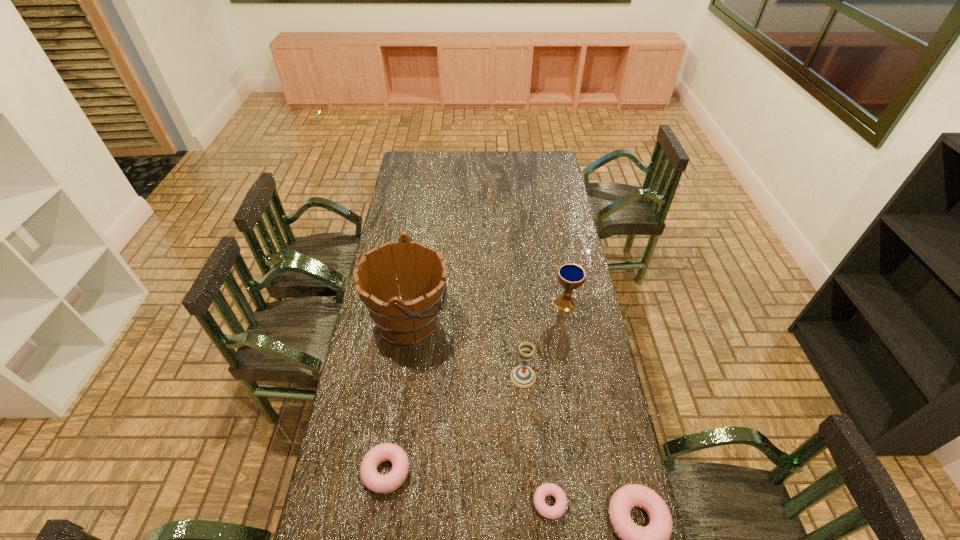
You are a GUI agent. You are given a task and a screenshot of the screen. Output one action in this format:
    pyautogui.click(x=<x>, y=<y>)
    Task: Click on the vacant space at the right edge of the desktop
    This screenshot has height=540, width=960.
    Given the screenshot: What is the action you would take?
    pyautogui.click(x=626, y=481)

Identify the location of free space that is in between the left chalice and the leftmost doughnut. (455, 423).

The image size is (960, 540). I want to click on vacant point located between the shortest object and the left chalice, so click(x=537, y=440).

You are a GUI agent. You are given a task and a screenshot of the screen. Output one action in this format:
    pyautogui.click(x=<x>, y=<y>)
    Task: Click on the vacant point located between the right chalice and the tallest object
    This screenshot has height=540, width=960.
    Given the screenshot: What is the action you would take?
    pyautogui.click(x=488, y=312)

You are a GUI agent. You are given a task and a screenshot of the screen. Output one action in this format:
    pyautogui.click(x=<x>, y=<y>)
    Task: Click on the free area in between the shortest doughnut and the fourth nearest object
    
    Given the screenshot: What is the action you would take?
    pyautogui.click(x=537, y=440)

You are a GUI agent. You are given a task and a screenshot of the screen. Output one action in this format:
    pyautogui.click(x=<x>, y=<y>)
    Task: Click on the empty space that is in between the second tallest doughnut and the shortest object
    The height and width of the screenshot is (540, 960).
    Given the screenshot: What is the action you would take?
    pyautogui.click(x=468, y=487)

The image size is (960, 540). In order to click on vacant space that's between the tallest object and the shortest doughnut in this screenshot , I will do [x=479, y=413].

Locate which object is the fifth closest to the farther chalice. Please provide its 2D coordinates. Your answer should be formatted as a tuple, i.e. [(x, y)], where the tuple contains the x and y coordinates of a point satisfying the conditions above.

[(371, 479)]

This screenshot has width=960, height=540. I want to click on the closest object to the third farthest object, so click(x=412, y=318).

Locate an element on the screen. The width and height of the screenshot is (960, 540). doughnut that stands as the second closest to the rightmost doughnut is located at coordinates click(x=371, y=479).